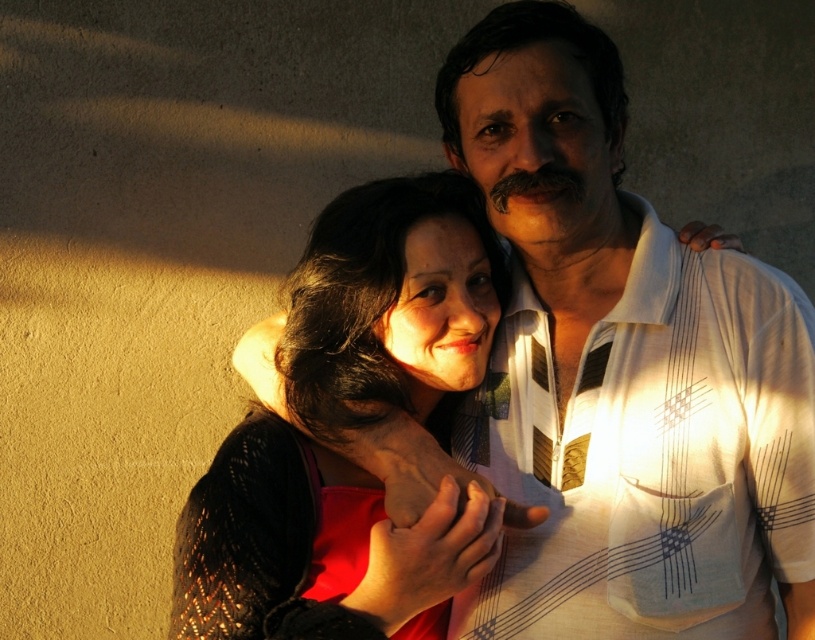
You are an observer looking at the scene described. Which clothing item is positioned higher on the person wearing them? The white striped shirt at center or the matte black sweater at center?

The white striped shirt at center is located above the matte black sweater at center, so the white striped shirt at center is positioned higher.

Based on the scene description, where is the white striped shirt at center positioned in relation to the other objects?

The white striped shirt at center is located at point (620, 368).

You are a photographer adjusting the focus on your camera. You have two points in the scene that you need to ensure are in focus. The first point is point (x=514, y=192) and the second is point (x=470, y=186). Which point should you focus on first to ensure both are sharp?

You should focus on point (x=514, y=192) first because it is closer to the camera, ensuring that both points will be in focus when using proper depth of field settings.